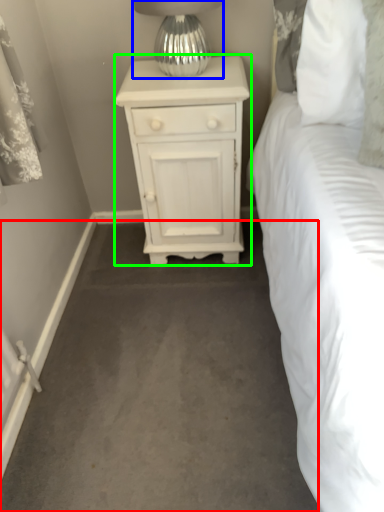
Question: Which object is the farthest from concrete (highlighted by a red box)? Choose among these: table lamp (highlighted by a blue box) or nightstand (highlighted by a green box).

Choices:
 (A) table lamp
 (B) nightstand

Answer: (A)